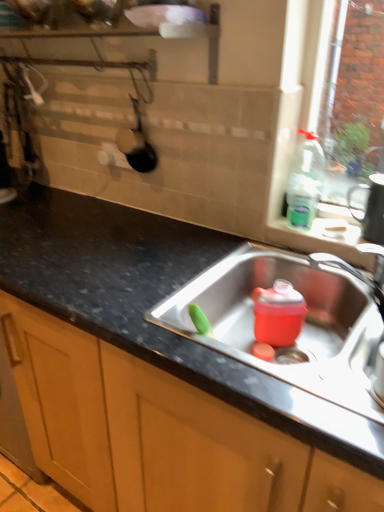
Question: Is black granite countertop at center at the back of stainless steel sink at center?

Choices:
 (A) no
 (B) yes

Answer: (B)

Question: Considering the relative sizes of stainless steel sink at center and black granite countertop at center in the image provided, is stainless steel sink at center shorter than black granite countertop at center?

Choices:
 (A) no
 (B) yes

Answer: (B)

Question: Does stainless steel sink at center have a smaller size compared to black granite countertop at center?

Choices:
 (A) no
 (B) yes

Answer: (B)

Question: Is the position of stainless steel sink at center more distant than that of black granite countertop at center?

Choices:
 (A) no
 (B) yes

Answer: (B)

Question: From a real-world perspective, is stainless steel sink at center over black granite countertop at center?

Choices:
 (A) yes
 (B) no

Answer: (A)

Question: From the image's perspective, is stainless steel sink at center beneath black granite countertop at center?

Choices:
 (A) yes
 (B) no

Answer: (B)

Question: From a real-world perspective, is black matte mug at upper right on top of stainless steel sink at center?

Choices:
 (A) no
 (B) yes

Answer: (B)

Question: Can you confirm if black matte mug at upper right is bigger than stainless steel sink at center?

Choices:
 (A) yes
 (B) no

Answer: (B)

Question: From the image's perspective, is black matte mug at upper right on top of stainless steel sink at center?

Choices:
 (A) yes
 (B) no

Answer: (A)

Question: Is black matte mug at upper right in front of stainless steel sink at center?

Choices:
 (A) no
 (B) yes

Answer: (A)

Question: Is black matte mug at upper right taller than stainless steel sink at center?

Choices:
 (A) no
 (B) yes

Answer: (B)

Question: Is black matte mug at upper right thinner than stainless steel sink at center?

Choices:
 (A) yes
 (B) no

Answer: (A)

Question: From a real-world perspective, is black granite countertop at center on top of metallic silver tap at right?

Choices:
 (A) no
 (B) yes

Answer: (A)